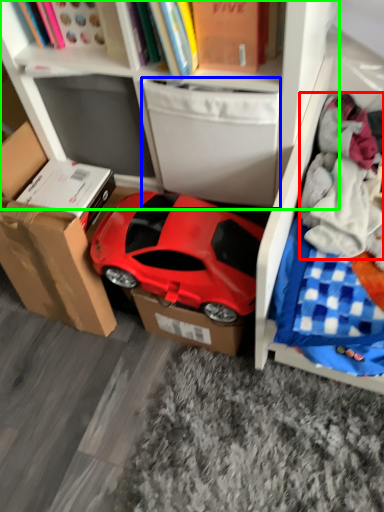
Question: Estimate the real-world distances between objects in this image. Which object is closer to clothing (highlighted by a red box), drawer (highlighted by a blue box) or bookcase (highlighted by a green box)?

Choices:
 (A) drawer
 (B) bookcase

Answer: (A)